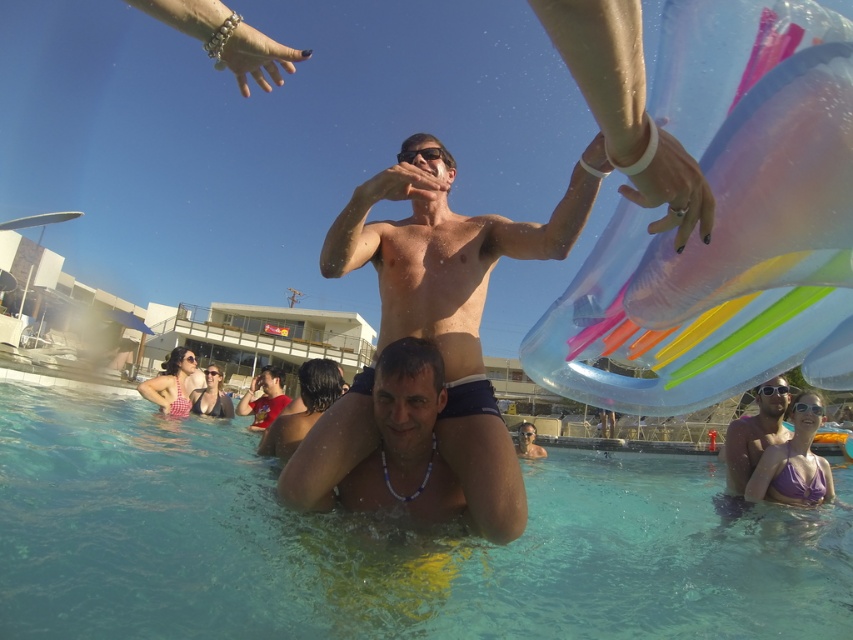
Which of these two, clear blue water at center or smooth red shirt at center, stands taller?

Standing taller between the two is smooth red shirt at center.

Does clear blue water at center appear on the right side of smooth red shirt at center?

Indeed, clear blue water at center is positioned on the right side of smooth red shirt at center.

Is point (264, 515) more distant than point (335, 378)?

That is False.

Locate an element on the screen. clear blue water at center is located at coordinates click(380, 545).

Who is positioned more to the left, shiny skin man at center or matte purple swimsuit at lower right?

shiny skin man at center is more to the left.

Can you confirm if shiny skin man at center is positioned to the right of matte purple swimsuit at lower right?

No, shiny skin man at center is not to the right of matte purple swimsuit at lower right.

Is point (448, 445) closer to viewer compared to point (796, 390)?

Yes.

The height and width of the screenshot is (640, 853). Identify the location of shiny skin man at center. [x=456, y=301].

Who is more forward, (x=386, y=368) or (x=300, y=385)?

Point (x=386, y=368)

Does beige beaded necklace at center have a lesser height compared to smooth red shirt at center?

Yes, beige beaded necklace at center is shorter than smooth red shirt at center.

Which is in front, point (349, 474) or point (309, 420)?

Point (349, 474)

Where is `beige beaded necklace at center`? beige beaded necklace at center is located at coordinates (405, 440).